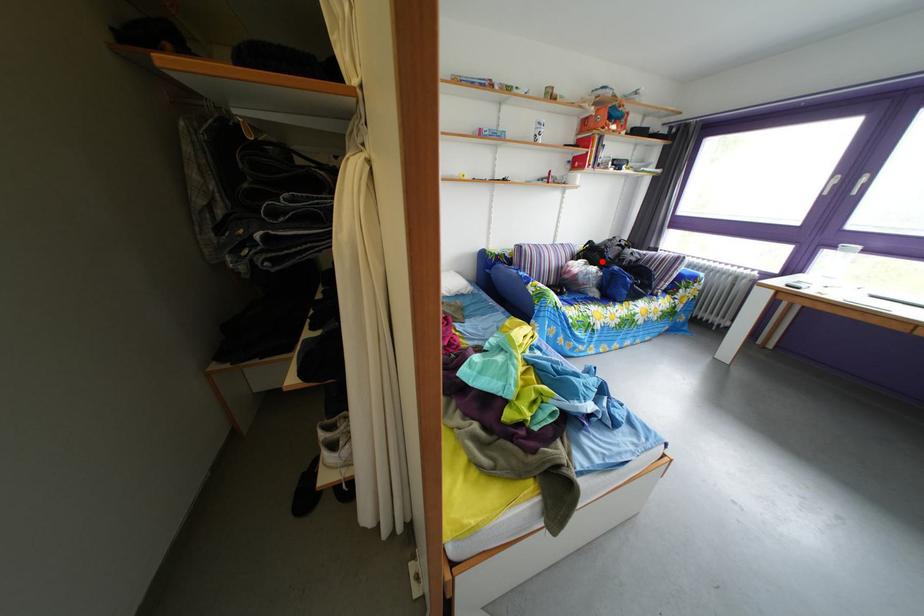
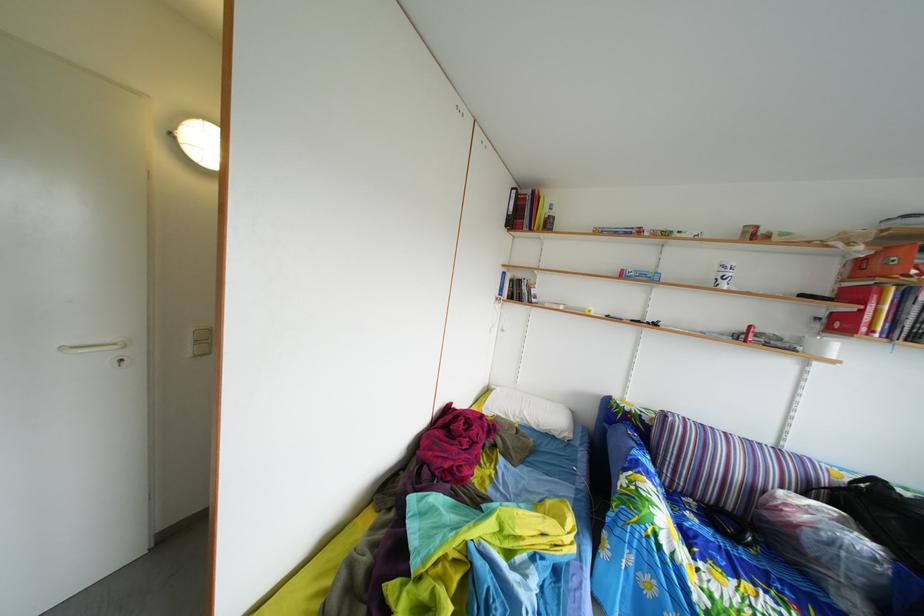
Find the pixel in the second image that matches the highlighted location in the first image.

(886, 515)